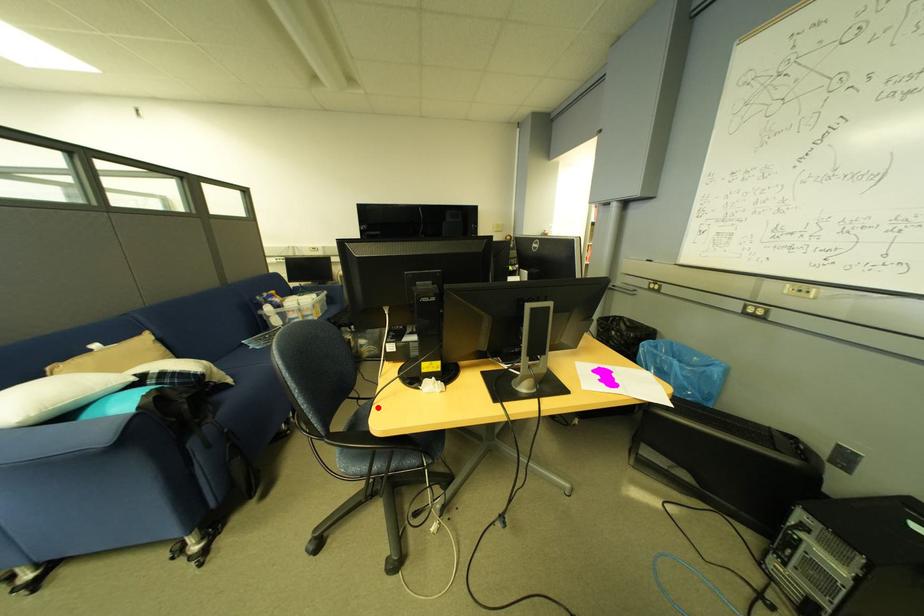
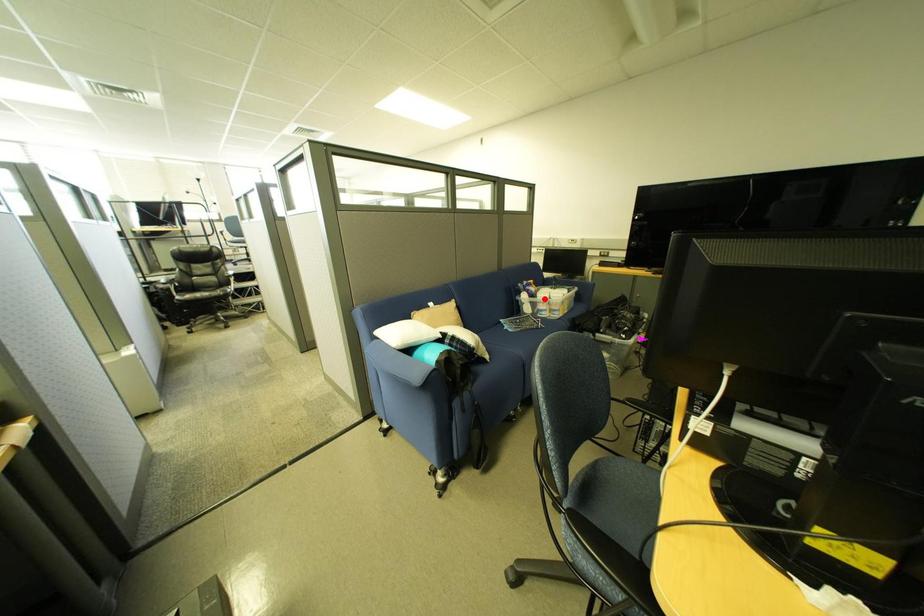
I am providing you with two images of the same scene from different viewpoints. A red point is marked on the first image and another point is marked on the second image. Do the highlighted points in image1 and image2 indicate the same real-world spot?

No